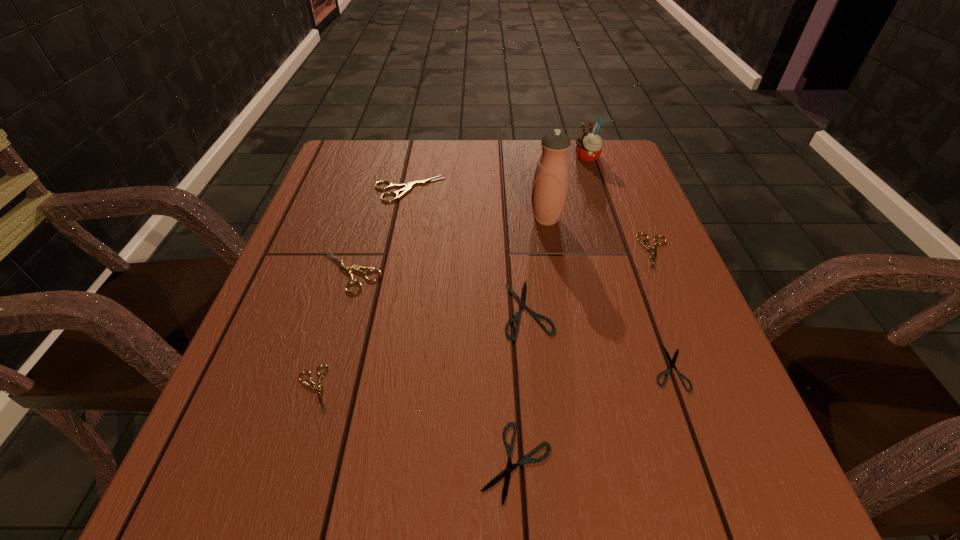
Find the location of a particular element. The image size is (960, 540). free space in the image that satisfies the following two spatial constraints: 1. on the front-facing side of the muffin; 2. on the left side of the smallest black shears is located at coordinates (659, 368).